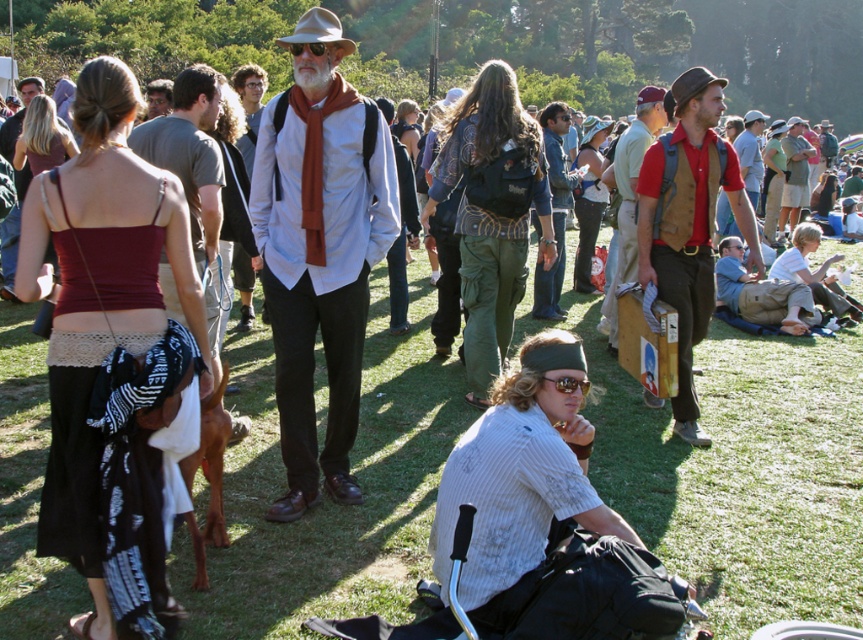
You are organizing a photo shoot and need to place a small camera bag next to the objects in the scene. Given that the denim jacket at center and the matte brown hat at center are both at the center, which object should you place the camera bag next to if it needs to be positioned closer to the smaller object?

The denim jacket at center is smaller than the matte brown hat at center, so you should place the camera bag next to the denim jacket at center to position it closer to the smaller object.

You are standing at the festival and want to know which of the two points, point (698, 204) or point (728, 252), is closer to you. Based on the scene description, which point is nearer?

Point (698, 204) is closer to the viewer than point (728, 252).

You are standing at the camera position and want to hand a flyer to the person wearing the red cotton shirt at center. Can you reach them without moving from your current position if your longest arm reach is 1.8 meters?

The distance between you and the red cotton shirt at center is 5.51 meters, which is greater than your 1.8 meter reach. You cannot reach them without moving.